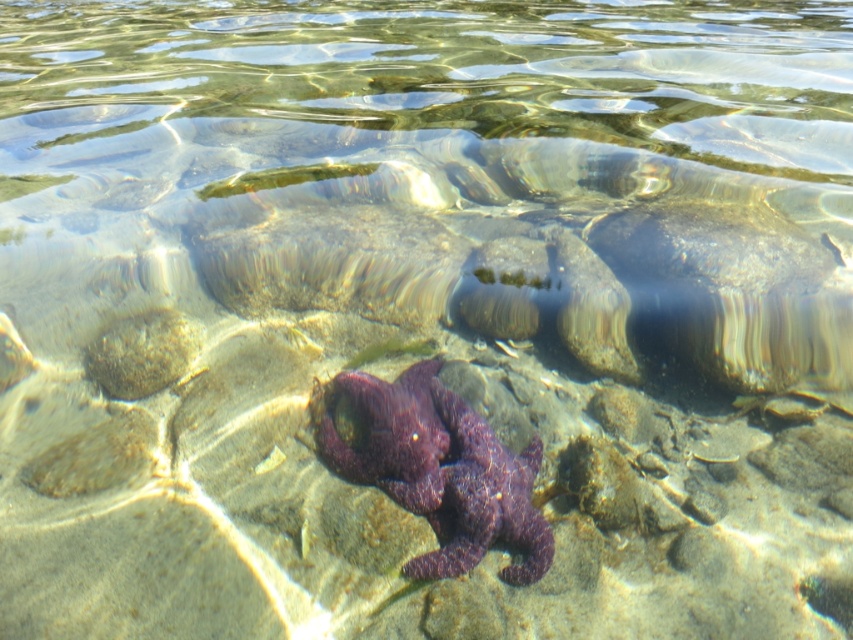
Question: Based on their relative distances, which object is farther from the purple rough starfish at center?

Choices:
 (A) purple matte starfish at center
 (B) smooth brown rock at lower left

Answer: (B)

Question: Can you confirm if purple rough starfish at center is positioned above smooth brown rock at lower left?

Choices:
 (A) no
 (B) yes

Answer: (A)

Question: Does purple matte starfish at center appear on the left side of smooth brown rock at lower left?

Choices:
 (A) no
 (B) yes

Answer: (A)

Question: Which object is closer to the camera taking this photo?

Choices:
 (A) smooth brown rock at lower left
 (B) purple matte starfish at center
 (C) purple rough starfish at center

Answer: (C)

Question: Can you confirm if purple rough starfish at center is bigger than purple matte starfish at center?

Choices:
 (A) no
 (B) yes

Answer: (A)

Question: Considering the real-world distances, which object is farthest from the purple rough starfish at center?

Choices:
 (A) purple matte starfish at center
 (B) smooth brown rock at lower left

Answer: (B)